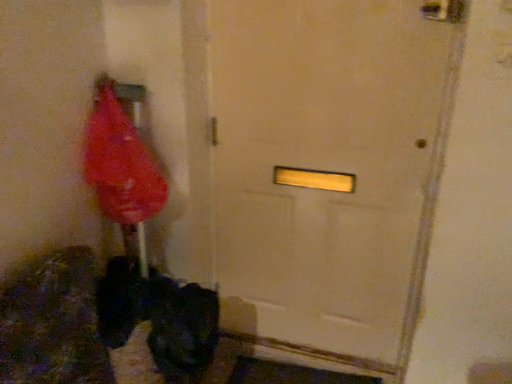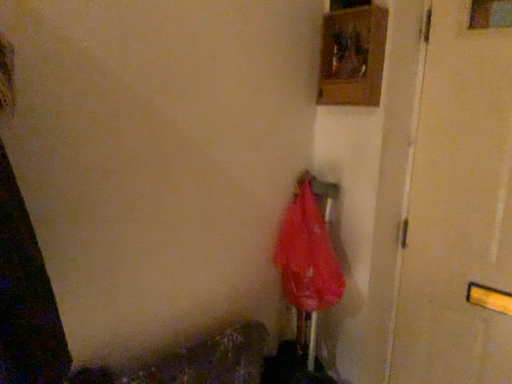
Question: Which way did the camera rotate in the video?

Choices:
 (A) rotated downward
 (B) rotated upward

Answer: (B)